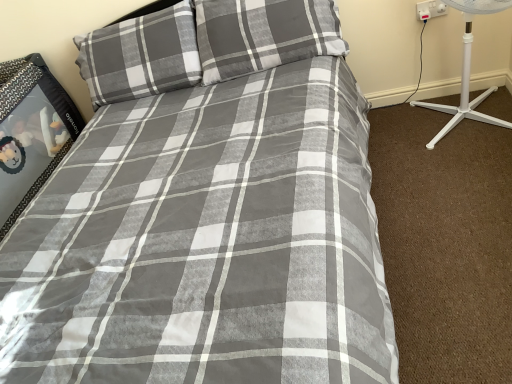
I want to click on free region under white plastic fan at right (from a real-world perspective), so pos(467,120).